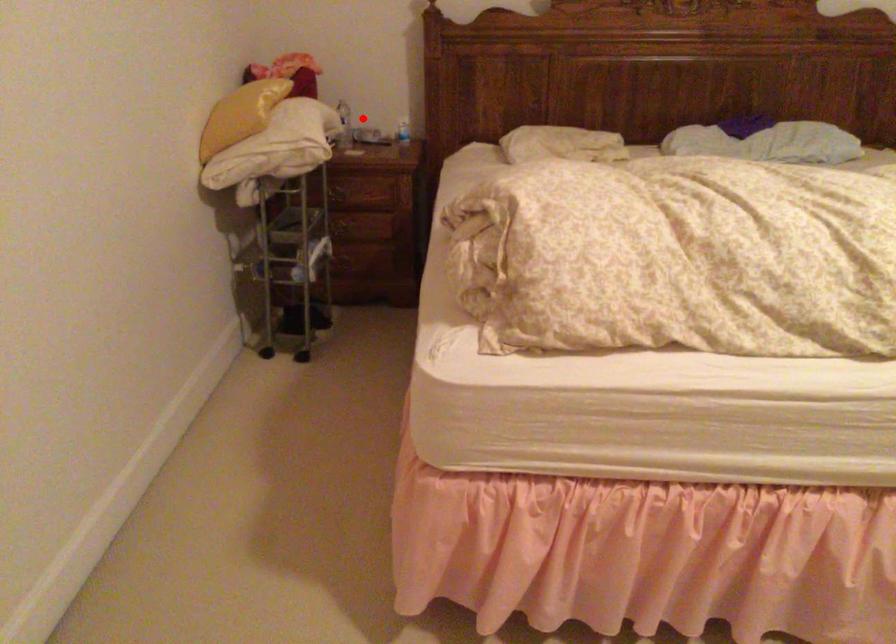
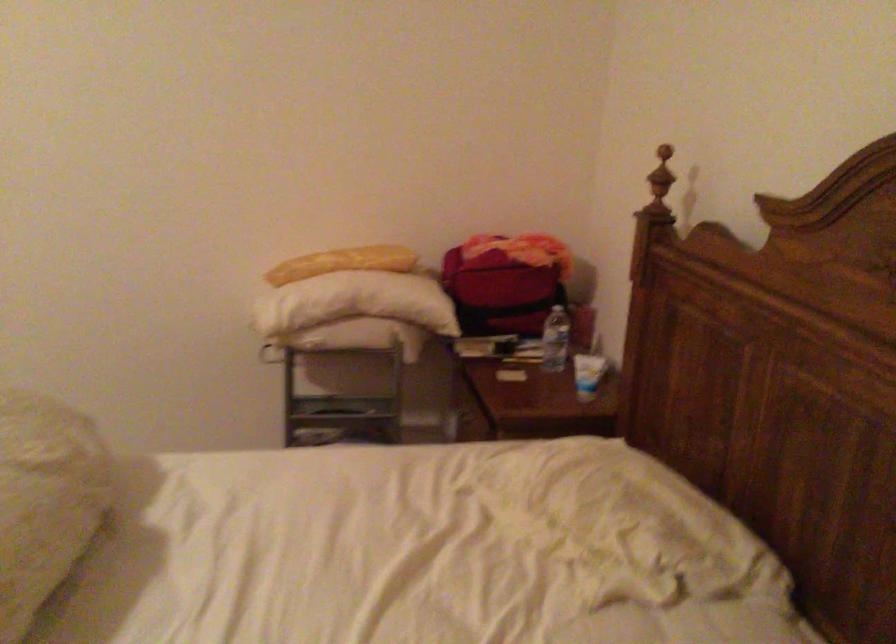
Locate, in the second image, the point that corresponds to the highlighted location in the first image.

(556, 339)